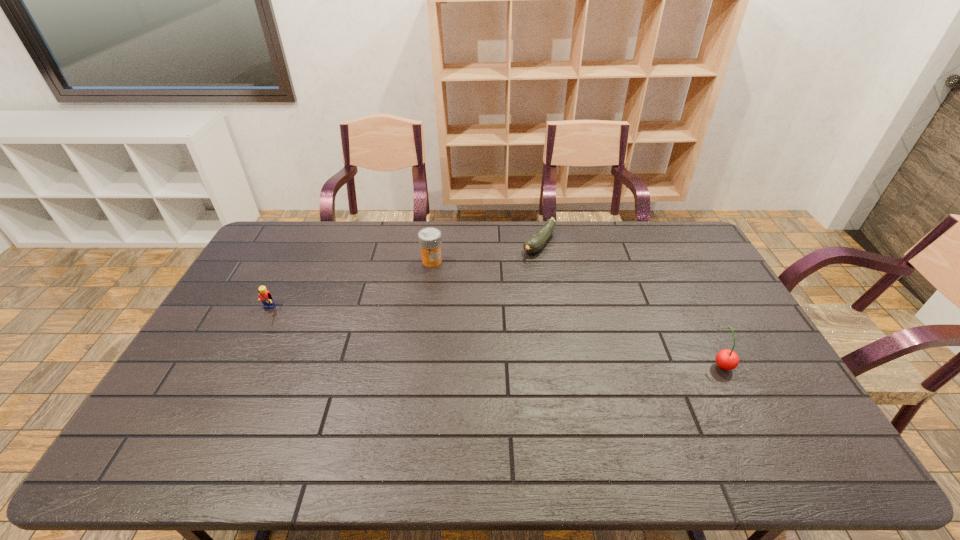
Identify the location of the leftmost object. Image resolution: width=960 pixels, height=540 pixels. (266, 298).

Find the location of a particular element. This screenshot has height=540, width=960. Lego is located at coordinates (266, 298).

Locate an element on the screen. The width and height of the screenshot is (960, 540). the nearest object is located at coordinates (726, 359).

You are a GUI agent. You are given a task and a screenshot of the screen. Output one action in this format:
    pyautogui.click(x=<x>, y=<y>)
    Task: Click on the cherry
    
    Given the screenshot: What is the action you would take?
    pyautogui.click(x=726, y=359)

The width and height of the screenshot is (960, 540). I want to click on the shortest object, so click(x=535, y=242).

The image size is (960, 540). I want to click on the third object from left to right, so click(535, 242).

Where is `the third object from right to left`? This screenshot has height=540, width=960. the third object from right to left is located at coordinates (430, 241).

At what (x,y) coordinates should I click in order to perform the action: click on vacant area situated on the front-facing side of the Lego. Please return your answer as a coordinate pair (x, y). The width and height of the screenshot is (960, 540). Looking at the image, I should click on (235, 375).

Locate an element on the screen. vacant region located on the left of the rightmost object is located at coordinates (620, 364).

Where is `blank space located at the blossom end of the shortest object`? blank space located at the blossom end of the shortest object is located at coordinates (490, 296).